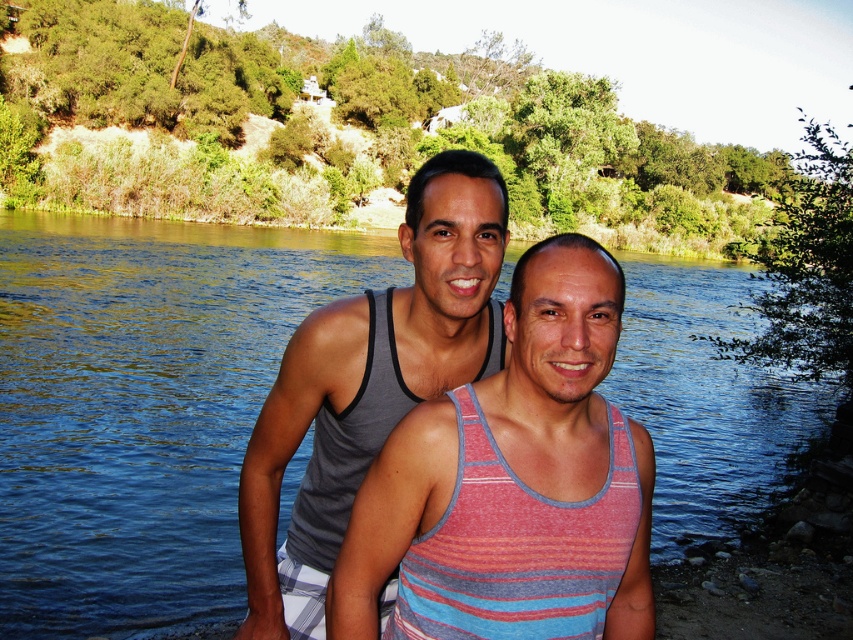
What are the coordinates of the striped cotton tank top at center?

The striped cotton tank top at center is located at coordinates point (514, 484).

You are trying to decide which tank top to wear for a day hike. You want something that isn not too bulky. Based on the image, which tank top, the striped cotton tank top at center or the gray heather tank top at center, is narrower and thus less bulky?

The striped cotton tank top at center is narrower than the gray heather tank top at center, making it a better choice for a less bulky option during your hike.

You are planning to take a photo of the blue water at center and the gray heather tank top at center. Which object should you focus on first if you want to capture both in the same frame without moving the camera?

You should focus on the blue water at center first because it is larger in size than the gray heather tank top at center, allowing it to be more prominently featured in the frame.